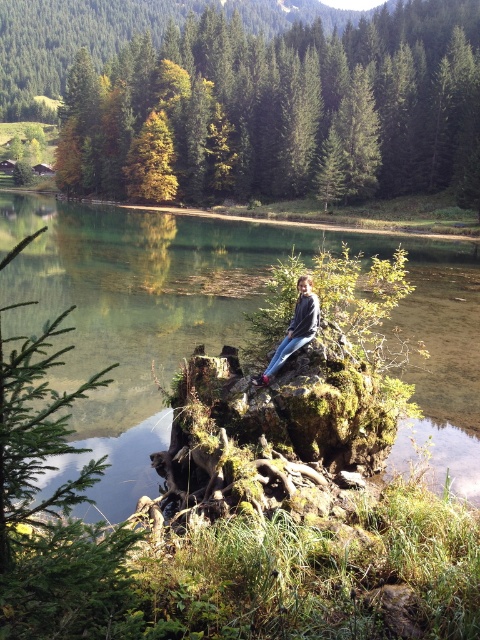
Question: Is clear water at center positioned at the back of blue jeans at center?

Choices:
 (A) no
 (B) yes

Answer: (B)

Question: Among these objects, which one is nearest to the camera?

Choices:
 (A) green matte tree at center
 (B) blue jeans at center
 (C) clear water at center

Answer: (B)

Question: Estimate the real-world distances between objects in this image. Which object is closer to the blue jeans at center?

Choices:
 (A) green matte tree at center
 (B) clear water at center

Answer: (B)

Question: Which of the following is the closest to the observer?

Choices:
 (A) (305, 328)
 (B) (137, 337)
 (C) (399, 180)

Answer: (A)

Question: Can you confirm if clear water at center is wider than green matte tree at center?

Choices:
 (A) yes
 (B) no

Answer: (B)

Question: Where is clear water at center located in relation to blue jeans at center in the image?

Choices:
 (A) below
 (B) above

Answer: (B)